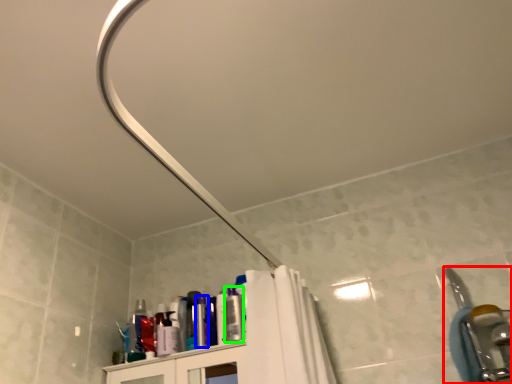
Question: Based on their relative distances, which object is nearer to plumbing fixture (highlighted by a red box)? Choose from toiletry (highlighted by a blue box) and toiletry (highlighted by a green box).

Choices:
 (A) toiletry
 (B) toiletry

Answer: (B)